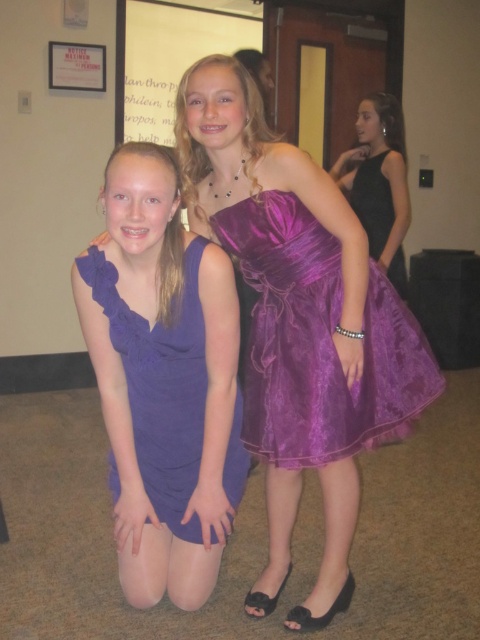
Question: Which of the following is the farthest from the observer?

Choices:
 (A) (365, 198)
 (B) (149, 440)
 (C) (126, 12)

Answer: (C)

Question: From the image, what is the correct spatial relationship of matte purple dress at lower left in relation to black satin dress at right?

Choices:
 (A) left
 (B) right

Answer: (A)

Question: Does velvet purple dress at upper center appear on the right side of black satin dress at right?

Choices:
 (A) no
 (B) yes

Answer: (A)

Question: Which object is closer to the camera taking this photo?

Choices:
 (A) black satin dress at right
 (B) matte white paper at upper center
 (C) matte purple dress at lower left
 (D) velvet purple dress at upper center

Answer: (C)

Question: Is velvet purple dress at upper center positioned at the back of matte white paper at upper center?

Choices:
 (A) no
 (B) yes

Answer: (A)

Question: Among these objects, which one is nearest to the camera?

Choices:
 (A) velvet purple dress at upper center
 (B) matte white paper at upper center

Answer: (A)